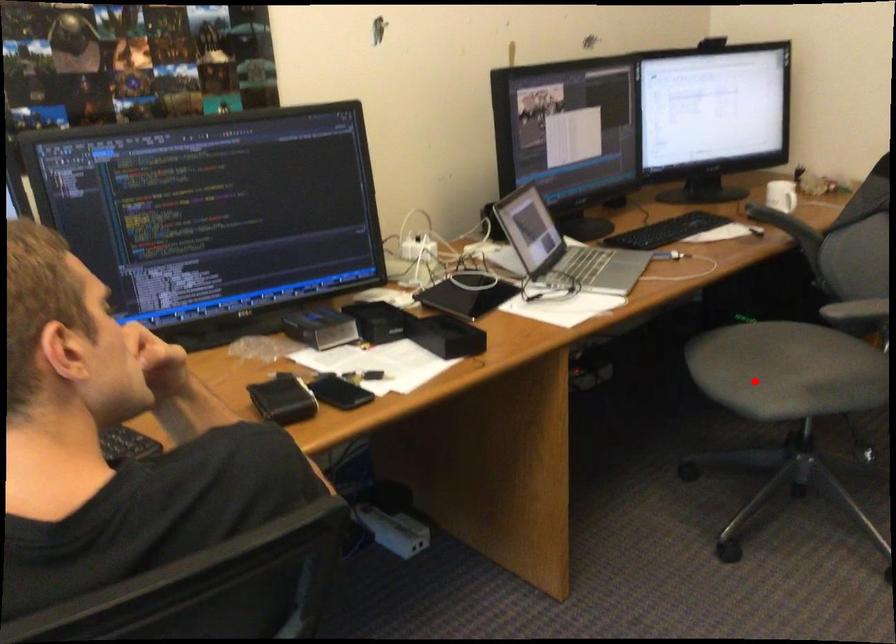
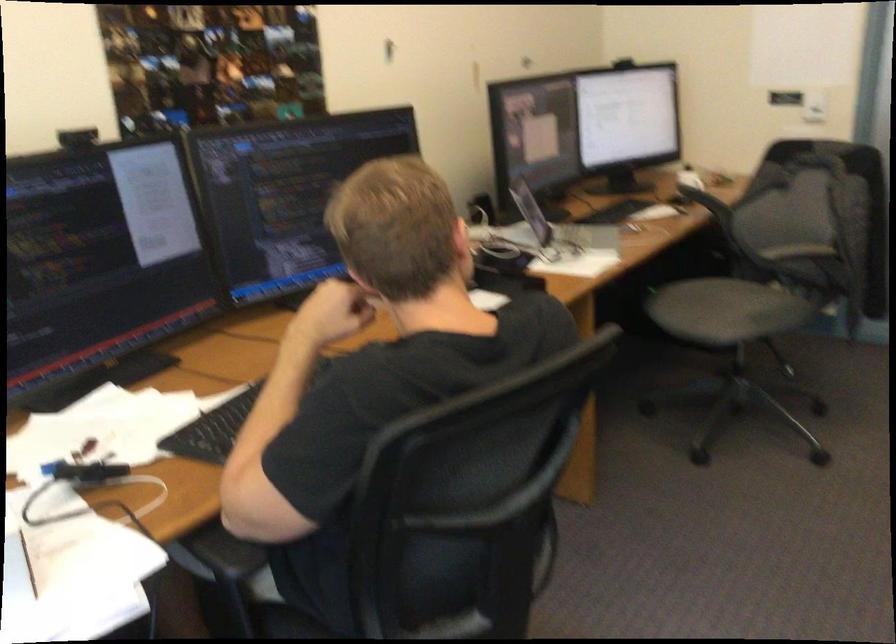
In the second image, find the point that corresponds to the highlighted location in the first image.

(709, 308)